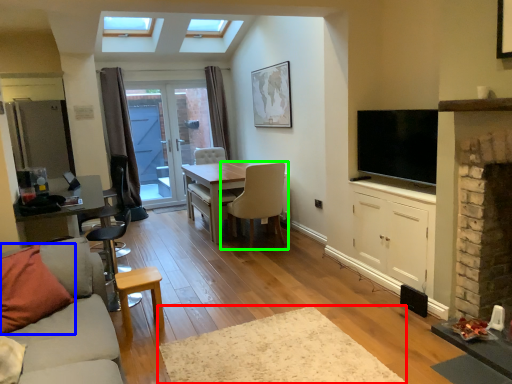
Question: Considering the real-world distances, which object is closest to plain (highlighted by a red box)? pillow (highlighted by a blue box) or chair (highlighted by a green box).

Choices:
 (A) pillow
 (B) chair

Answer: (A)